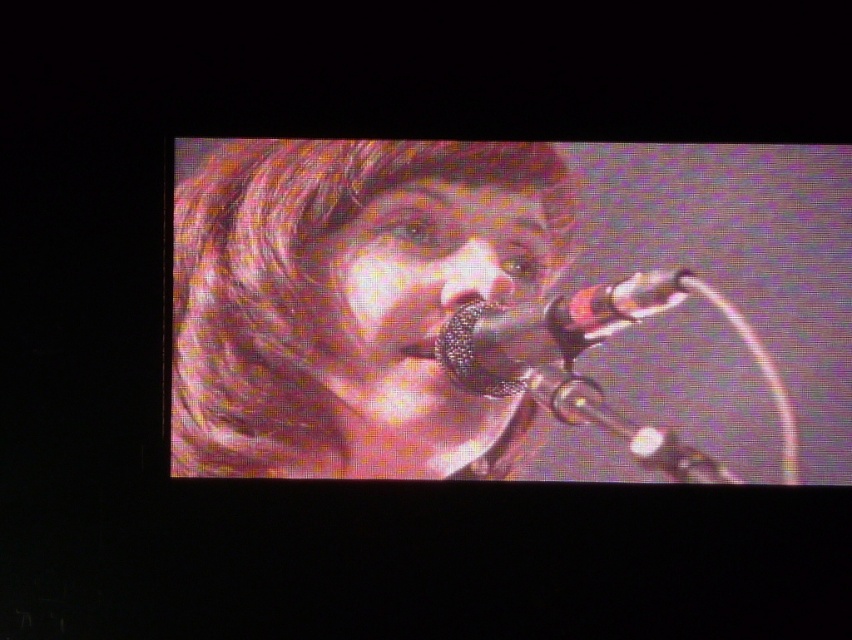
You are a sound engineer setting up for a live performance. You have two microphones available, the shiny black microphone at center and the metallic mesh microphone at center. The stage has a limited space between the performer and the soundboard. Which microphone should you choose to ensure it fits comfortably in the tight space?

The metallic mesh microphone at center is smaller in size compared to the shiny black microphone at center, so it would fit better in the tight space between the performer and the soundboard.

You are a sound engineer setting up equipment for a live performance. You have two microphones on the stage, a shiny black microphone at center and a metallic mesh microphone at center. The stage is narrow, and you need to place them side by side. Given the space between them, can both microphones fit within a 15 inch wide section of the stage?

The distance between the shiny black microphone at center and the metallic mesh microphone at center is 14.22 inches. Since 14.22 inches is less than 15 inches, both microphones can fit within the 15 inch wide section of the stage.